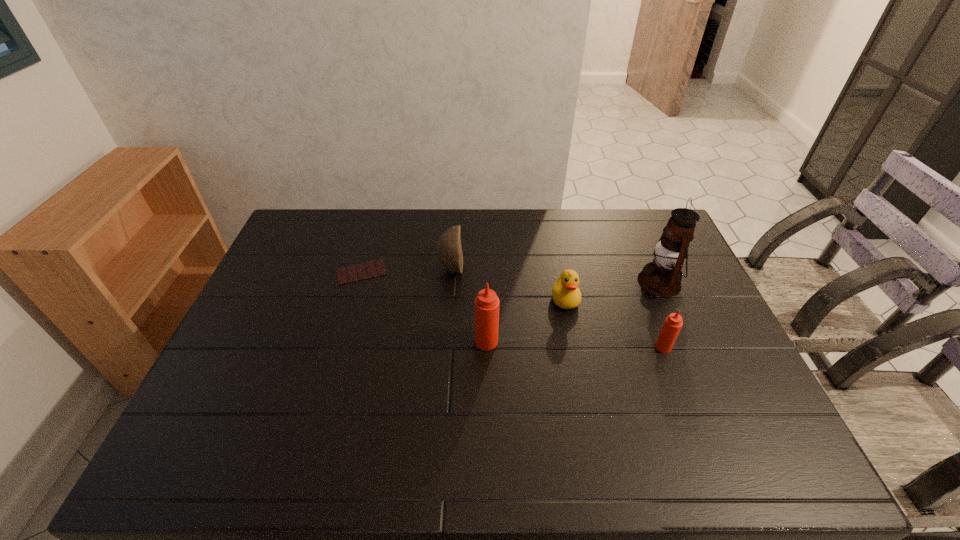
At what (x,y) coordinates should I click in order to perform the action: click on vacant space located on the front of the shorter Tabasco sauce. Please return your answer as a coordinate pair (x, y). Looking at the image, I should click on (680, 392).

The height and width of the screenshot is (540, 960). I want to click on free point located 0.270m at the beak of the second shortest object, so click(584, 392).

The height and width of the screenshot is (540, 960). What are the coordinates of `free region located on the right of the shortest object` in the screenshot? It's located at (458, 272).

This screenshot has width=960, height=540. I want to click on vacant space located on the side of the lantern, there is a wick adjustment knob, so click(x=569, y=282).

In order to click on free region located 0.280m on the side of the lantern, there is a wick adjustment knob in this screenshot , I will do `click(551, 282)`.

Find the location of a particular element. This screenshot has height=540, width=960. vacant space situated 0.340m on the side of the lantern, there is a wick adjustment knob is located at coordinates (532, 282).

Where is `free region located 0.140m on the front of the bowl`? The width and height of the screenshot is (960, 540). free region located 0.140m on the front of the bowl is located at coordinates coord(448,316).

Locate an element on the screen. This screenshot has width=960, height=540. object located at the right edge is located at coordinates (662, 277).

This screenshot has width=960, height=540. In the image, there is a desktop. Identify the location of blank space at the far edge. (575, 230).

I want to click on free space at the near edge, so click(536, 416).